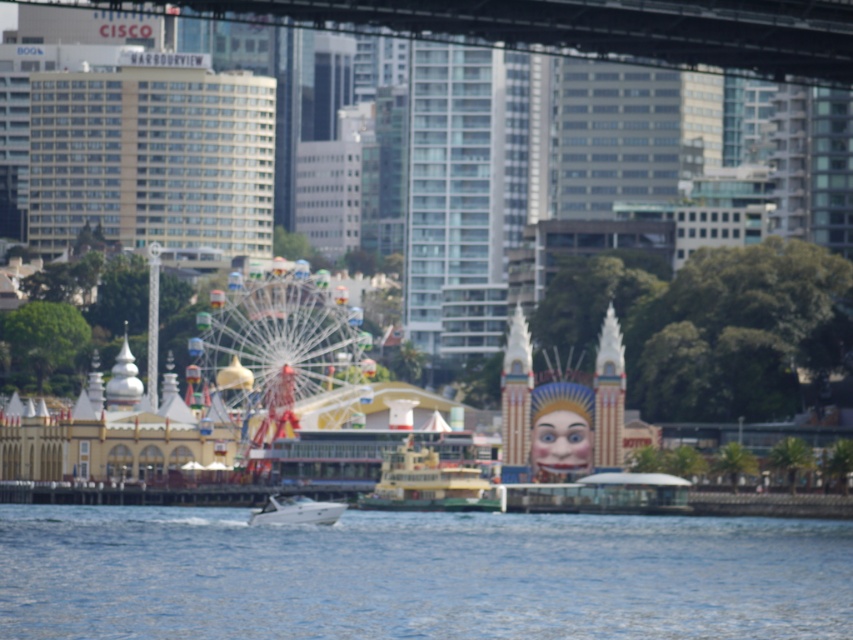
You are a photographer taking a picture of the waterfront scene. You want to ensure the white glossy boat at center is centered in the frame. Where should you position the blue water at lower center relative to the boat?

The blue water at lower center is positioned below the white glossy boat at center, so to center the boat in the frame, you should position the blue water at lower center directly beneath it.

You are standing on the dock and see the point at coordinates (x=418, y=573). Is this point located on the blue water at lower center?

Yes, the point at coordinates (x=418, y=573) is located on the blue water at lower center according to the provided description.